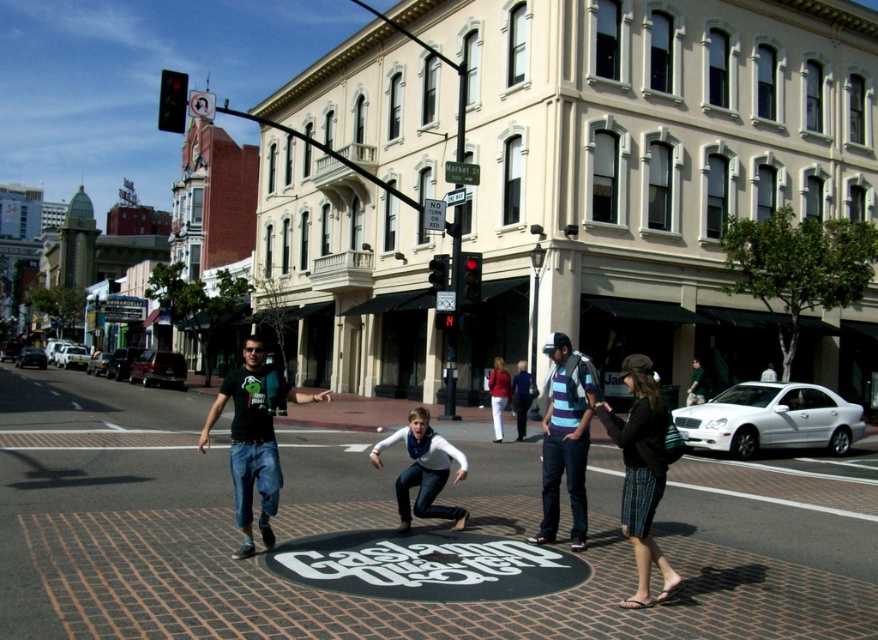
Question: Which point appears farthest from the camera in this image?

Choices:
 (A) (247, 401)
 (B) (627, 522)

Answer: (A)

Question: Does black textured pants at lower right have a larger size compared to dark green t-shirt at center?

Choices:
 (A) yes
 (B) no

Answer: (B)

Question: In this image, where is black textured pants at lower right located relative to striped cotton shirt at center?

Choices:
 (A) above
 (B) below

Answer: (B)

Question: Which of the following is the closest to the observer?

Choices:
 (A) black textured pants at lower right
 (B) dark green t-shirt at center

Answer: (A)

Question: Is black textured pants at lower right above striped cotton shirt at center?

Choices:
 (A) yes
 (B) no

Answer: (B)

Question: Which object is closer to the camera taking this photo?

Choices:
 (A) striped cotton shirt at center
 (B) black textured pants at lower right

Answer: (B)